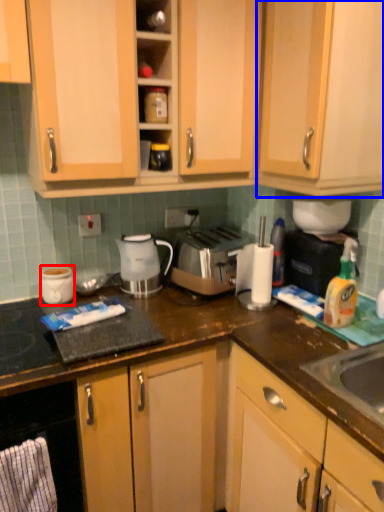
Question: Among these objects, which one is farthest to the camera, appliance (highlighted by a red box) or cabinetry (highlighted by a blue box)?

Choices:
 (A) appliance
 (B) cabinetry

Answer: (A)